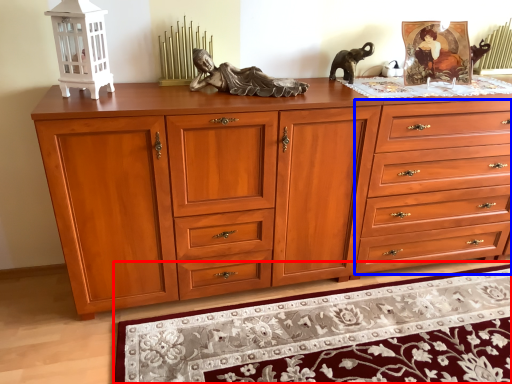
Question: Which object is further to the camera taking this photo, mat (highlighted by a red box) or drawer (highlighted by a blue box)?

Choices:
 (A) mat
 (B) drawer

Answer: (B)